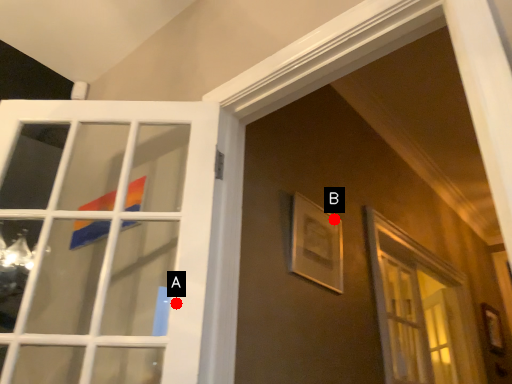
Question: Two points are circled on the image, labeled by A and B beside each circle. Which point is closer to the camera?

Choices:
 (A) A is closer
 (B) B is closer

Answer: (A)